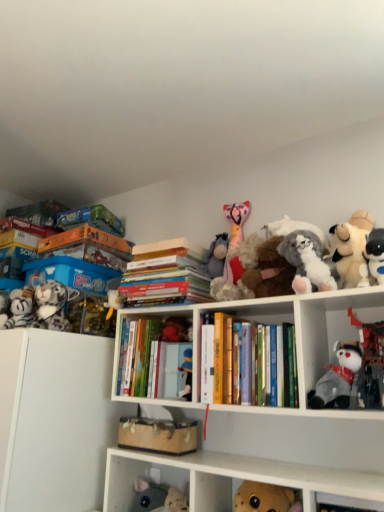
Question: Is fluffy gray plush at left, the 2th toy in the left-to-right sequence, turned away from fluffy white stuffed animal at upper right, which is the 3th toy from right to left?

Choices:
 (A) no
 (B) yes

Answer: (A)

Question: Is fluffy gray plush at left, the 2th toy in the left-to-right sequence, completely or partially outside of fluffy white stuffed animal at upper right, which ranks as the eighth toy in left-to-right order?

Choices:
 (A) no
 (B) yes

Answer: (B)

Question: Is fluffy gray plush at left, placed as the 9th toy when sorted from right to left, far from fluffy white stuffed animal at upper right, which is the 3th toy from right to left?

Choices:
 (A) no
 (B) yes

Answer: (A)

Question: Considering the relative sizes of fluffy gray plush at left, placed as the 9th toy when sorted from right to left, and fluffy white stuffed animal at upper right, which ranks as the eighth toy in left-to-right order, in the image provided, is fluffy gray plush at left, placed as the 9th toy when sorted from right to left, bigger than fluffy white stuffed animal at upper right, which ranks as the eighth toy in left-to-right order,?

Choices:
 (A) no
 (B) yes

Answer: (A)

Question: From a real-world perspective, does fluffy gray plush at left, the 2th toy in the left-to-right sequence, stand above fluffy white stuffed animal at upper right, which ranks as the eighth toy in left-to-right order?

Choices:
 (A) no
 (B) yes

Answer: (A)

Question: From the image's perspective, relative to hardcover books at center, the 1th book positioned from the right, is white plush toy at upper right, which is the 2th toy in right-to-left order, above or below?

Choices:
 (A) above
 (B) below

Answer: (A)

Question: Is point (377, 246) positioned closer to the camera than point (200, 369)?

Choices:
 (A) closer
 (B) farther

Answer: (A)

Question: Is white plush toy at upper right, which ranks as the 9th toy in left-to-right order, taller or shorter than hardcover books at center, the 1th book positioned from the right?

Choices:
 (A) short
 (B) tall

Answer: (A)

Question: Would you say white plush toy at upper right, which ranks as the 9th toy in left-to-right order, is inside or outside hardcover books at center, the 1th book positioned from the right?

Choices:
 (A) inside
 (B) outside

Answer: (B)

Question: Considering the positions of white plush toy at right, the first toy when ordered from right to left, and gray plush toy at center-right, which is the seventh toy from left to right, in the image, is white plush toy at right, the first toy when ordered from right to left, bigger or smaller than gray plush toy at center-right, which is the seventh toy from left to right,?

Choices:
 (A) small
 (B) big

Answer: (B)

Question: From a real-world perspective, relative to gray plush toy at center-right, which is the seventh toy from left to right, is white plush toy at right, acting as the tenth toy starting from the left, vertically above or below?

Choices:
 (A) below
 (B) above

Answer: (B)

Question: Is white plush toy at right, acting as the tenth toy starting from the left, spatially inside gray plush toy at center-right, which is the seventh toy from left to right, or outside of it?

Choices:
 (A) inside
 (B) outside

Answer: (B)

Question: Looking at their shapes, would you say white plush toy at right, the first toy when ordered from right to left, is wider or thinner than gray plush toy at center-right, placed as the fourth toy when sorted from right to left?

Choices:
 (A) wide
 (B) thin

Answer: (A)

Question: From a real-world perspective, is white plush toy at right, acting as the tenth toy starting from the left, physically located above or below velvet plush bear at center, which ranks as the third toy in left-to-right order?

Choices:
 (A) above
 (B) below

Answer: (B)

Question: From their relative heights in the image, would you say white plush toy at right, acting as the tenth toy starting from the left, is taller or shorter than velvet plush bear at center, which ranks as the third toy in left-to-right order?

Choices:
 (A) tall
 (B) short

Answer: (A)